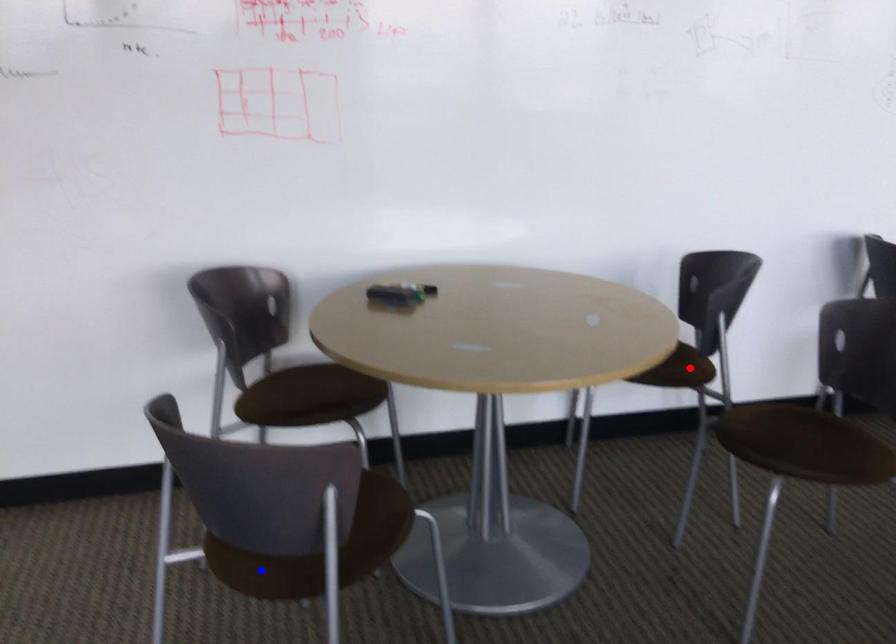
Question: In the image, two points are highlighted. Which point is nearer to the camera? Reply with the corresponding letter.

Choices:
 (A) blue point
 (B) red point

Answer: (A)